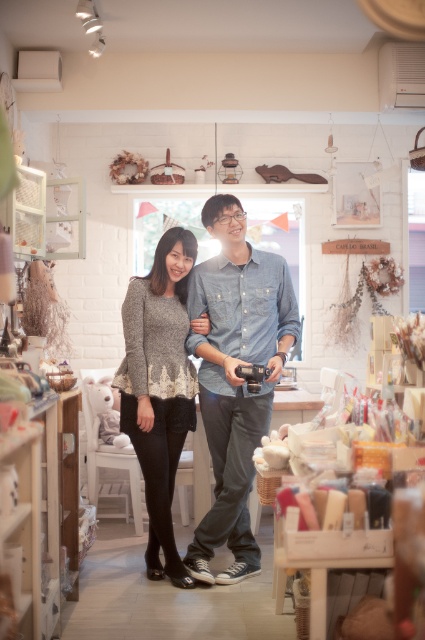
You are a tailor working in this shop and need to place a 10 inch wide decorative pillow between the denim shirt at center and the knitted gray sweater at center. Is there enough space between them to fit the pillow?

The distance between the denim shirt at center and the knitted gray sweater at center is only 8.85 inches, which is less than the 10 inch width of the decorative pillow. Therefore, there isn not enough space to fit the pillow between them.

You are an assistant organizing items in a store. You need to place a new item between the denim shirt at center and the knitted gray sweater at center. Based on their current positions, where should you place the new item?

The denim shirt at center is located above the knitted gray sweater at center, so you should place the new item between them either below the denim shirt at center and above the knitted gray sweater at center.